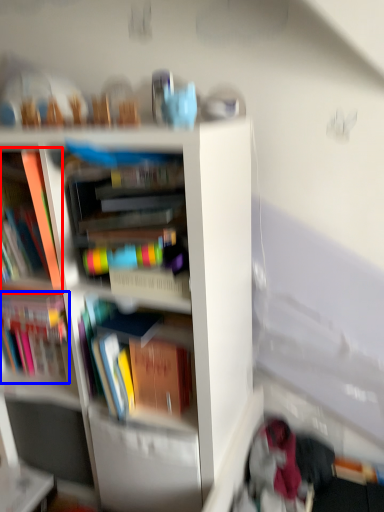
Question: Which point is further to the camera, book (highlighted by a red box) or book (highlighted by a blue box)?

Choices:
 (A) book
 (B) book

Answer: (B)